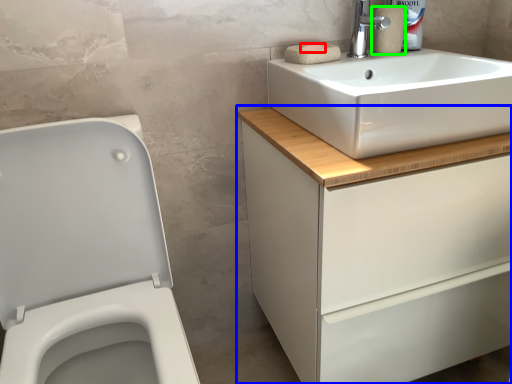
Question: Based on their relative distances, which object is farther from soap (highlighted by a red box)? Choose from bathroom cabinet (highlighted by a blue box) and toilet paper (highlighted by a green box).

Choices:
 (A) bathroom cabinet
 (B) toilet paper

Answer: (A)